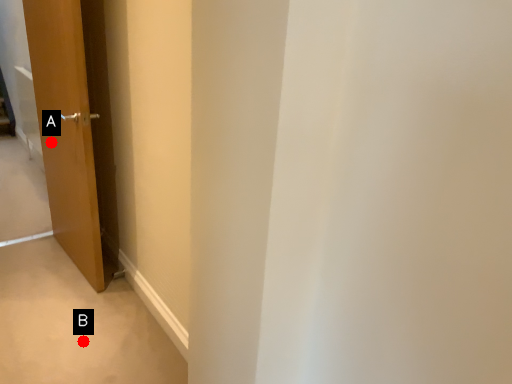
Question: Two points are circled on the image, labeled by A and B beside each circle. Which point is further to the camera?

Choices:
 (A) A is further
 (B) B is further

Answer: (A)